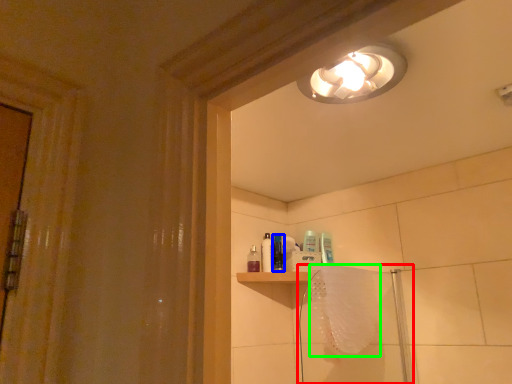
Question: Which object is positioned closest to shower door (highlighted by a red box)? Select from toiletry (highlighted by a blue box) and bath towel (highlighted by a green box).

Choices:
 (A) toiletry
 (B) bath towel

Answer: (B)